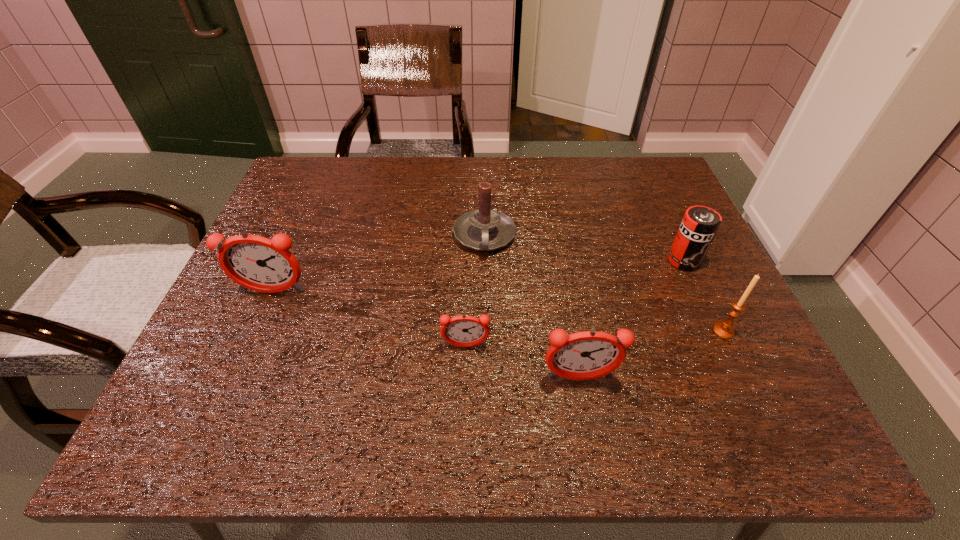
Image resolution: width=960 pixels, height=540 pixels. Identify the location of vacant space located on the front-facing side of the second alarm clock from right to left. (465, 373).

Where is `vacant space located 0.150m on the back of the candle_holder`? vacant space located 0.150m on the back of the candle_holder is located at coordinates click(696, 272).

The image size is (960, 540). I want to click on vacant point located 0.260m on the back of the can, so click(x=651, y=190).

This screenshot has height=540, width=960. Find the location of `vacant space located on the side of the candle with the handle loop`. vacant space located on the side of the candle with the handle loop is located at coordinates pyautogui.click(x=486, y=356).

Where is `object that is at the near edge`? The height and width of the screenshot is (540, 960). object that is at the near edge is located at coordinates (585, 355).

Where is `object that is at the left edge`? object that is at the left edge is located at coordinates (255, 262).

Identify the location of candle_holder that is at the right edge. Image resolution: width=960 pixels, height=540 pixels. (724, 329).

Where is `can that is at the right edge`? The image size is (960, 540). can that is at the right edge is located at coordinates (700, 224).

Identify the location of vacant space at the far edge. (578, 187).

Locate an element on the screen. Image resolution: width=960 pixels, height=540 pixels. vacant space at the near edge is located at coordinates (385, 391).